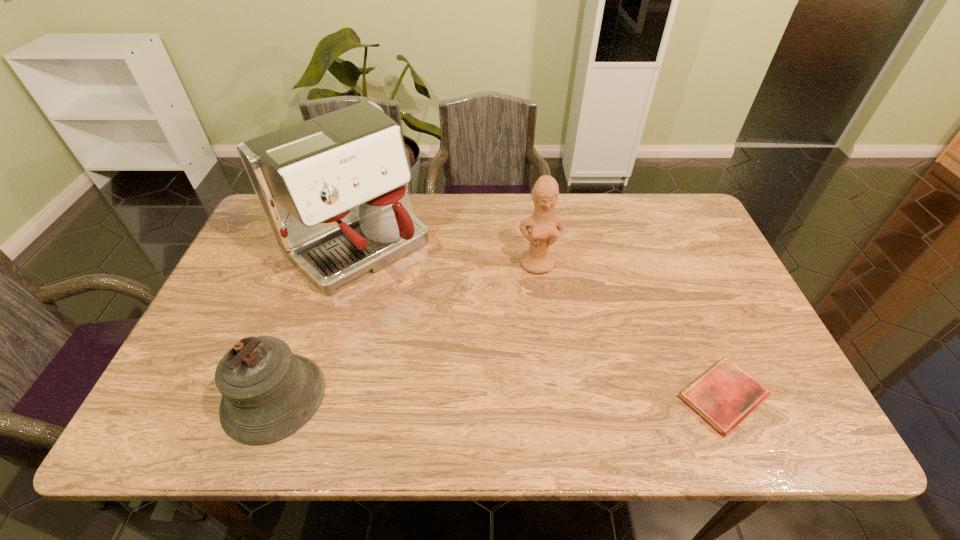
The height and width of the screenshot is (540, 960). What are the coordinates of `vacant space in between the diary and the second shortest object` in the screenshot? It's located at (498, 396).

At what (x,y) coordinates should I click in order to perform the action: click on vacant region between the third tallest object and the second object from right to left. Please return your answer as a coordinate pair (x, y). Looking at the image, I should click on (406, 330).

Where is `empty space that is in between the bell and the coffee maker`? empty space that is in between the bell and the coffee maker is located at coordinates (315, 320).

Image resolution: width=960 pixels, height=540 pixels. What are the coordinates of `vacant area that lies between the figurine and the second shortest object` in the screenshot? It's located at (406, 330).

This screenshot has width=960, height=540. What are the coordinates of `vacant space that is in between the diary and the second shortest object` in the screenshot? It's located at (498, 396).

Where is `blank region between the diary and the third object from left to right`? blank region between the diary and the third object from left to right is located at coordinates (630, 330).

Locate an element on the screen. free space between the rightmost object and the tallest object is located at coordinates (540, 320).

This screenshot has width=960, height=540. In order to click on free space between the rightmost object and the third tallest object in this screenshot , I will do `click(498, 396)`.

Identify the location of object that can be found as the closest to the tallest object. This screenshot has height=540, width=960. (268, 393).

The width and height of the screenshot is (960, 540). I want to click on the third closest object relative to the second tallest object, so click(x=268, y=393).